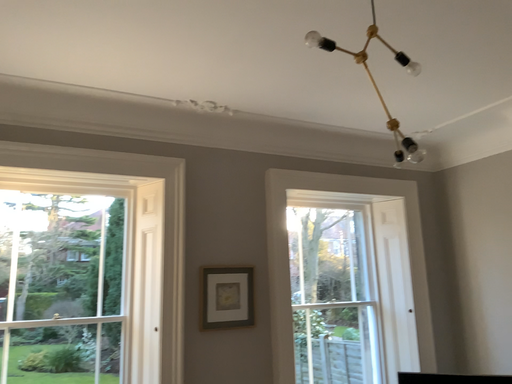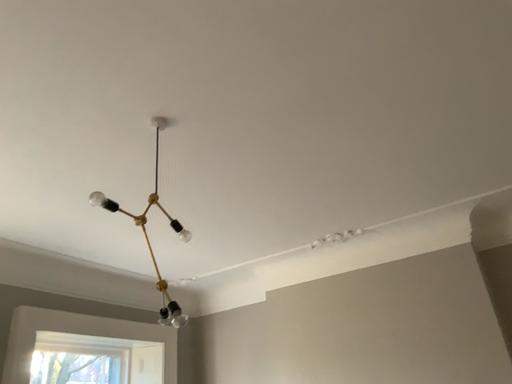
Question: How did the camera likely rotate when shooting the video?

Choices:
 (A) rotated left
 (B) rotated right

Answer: (B)